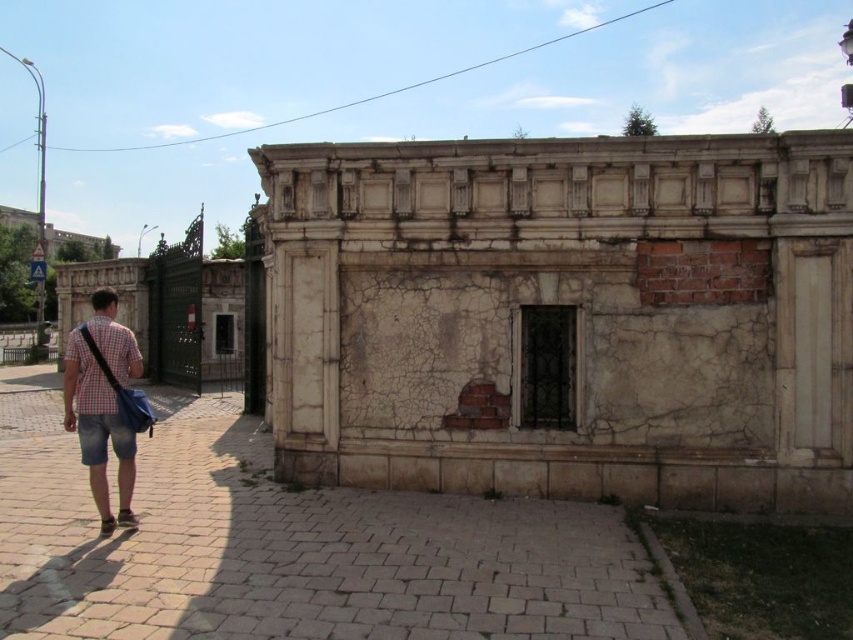
Question: Can you confirm if brick pavement at lower center is bigger than checkered fabric shirt at left?

Choices:
 (A) yes
 (B) no

Answer: (B)

Question: Can you confirm if brick pavement at lower center is wider than checkered fabric shirt at left?

Choices:
 (A) yes
 (B) no

Answer: (B)

Question: From the image, what is the correct spatial relationship of brick pavement at lower center in relation to checkered fabric shirt at left?

Choices:
 (A) left
 (B) right

Answer: (B)

Question: Which object is closer to the camera taking this photo?

Choices:
 (A) checkered fabric shirt at left
 (B) brick pavement at lower center

Answer: (B)

Question: Which of the following is the closest to the observer?

Choices:
 (A) (378, 528)
 (B) (93, 358)

Answer: (B)